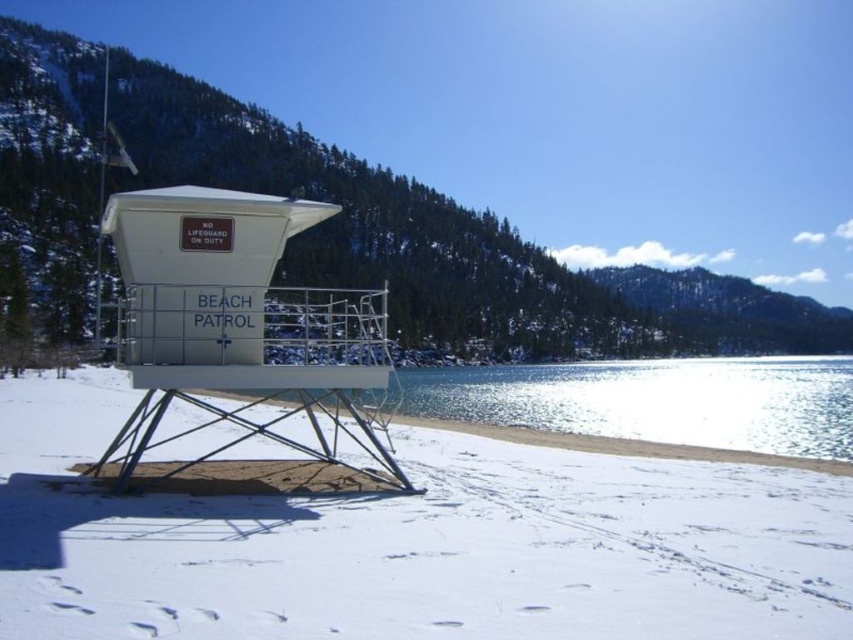
Question: Is white powdery snow at lower center thinner than glistening ice water at center?

Choices:
 (A) no
 (B) yes

Answer: (B)

Question: Among these objects, which one is farthest from the camera?

Choices:
 (A) glistening ice water at center
 (B) white powdery snow at lower center

Answer: (A)

Question: Which object appears closest to the camera in this image?

Choices:
 (A) white powdery snow at lower center
 (B) glistening ice water at center

Answer: (A)

Question: Does white powdery snow at lower center come in front of glistening ice water at center?

Choices:
 (A) yes
 (B) no

Answer: (A)

Question: Is white powdery snow at lower center wider than glistening ice water at center?

Choices:
 (A) yes
 (B) no

Answer: (B)

Question: Which point is farther to the camera?

Choices:
 (A) (299, 532)
 (B) (761, 451)

Answer: (B)